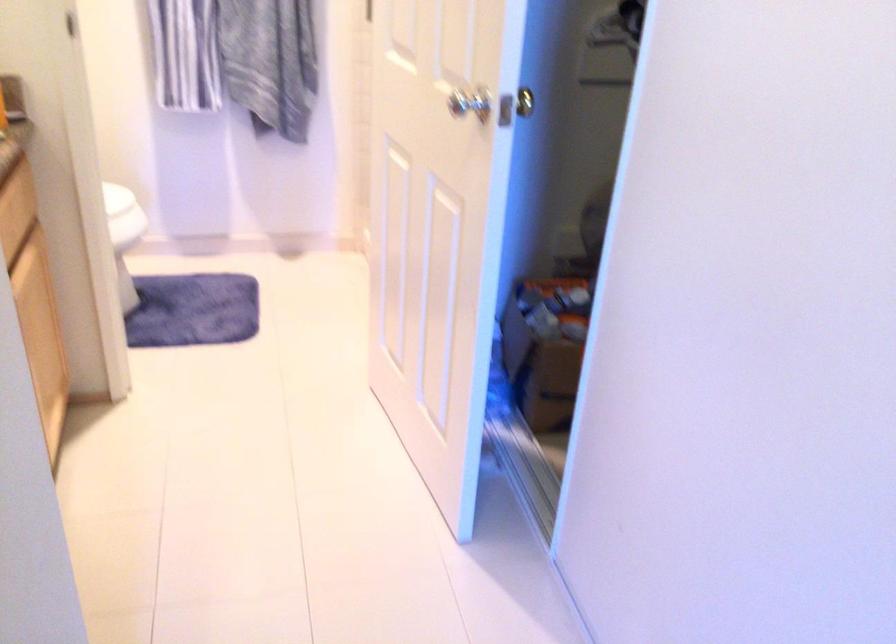
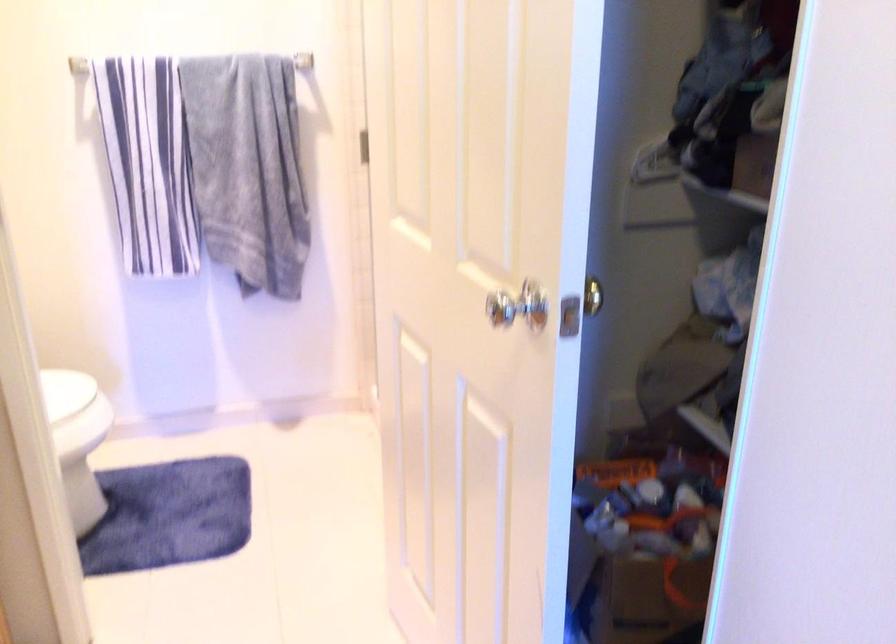
Locate, in the second image, the point that corresponds to point 116,205 in the first image.

(72, 400)